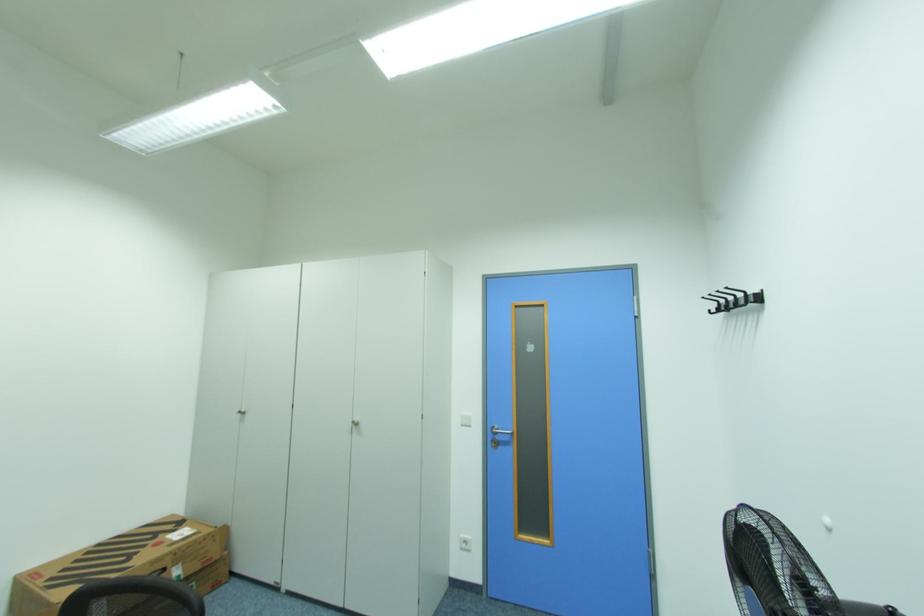
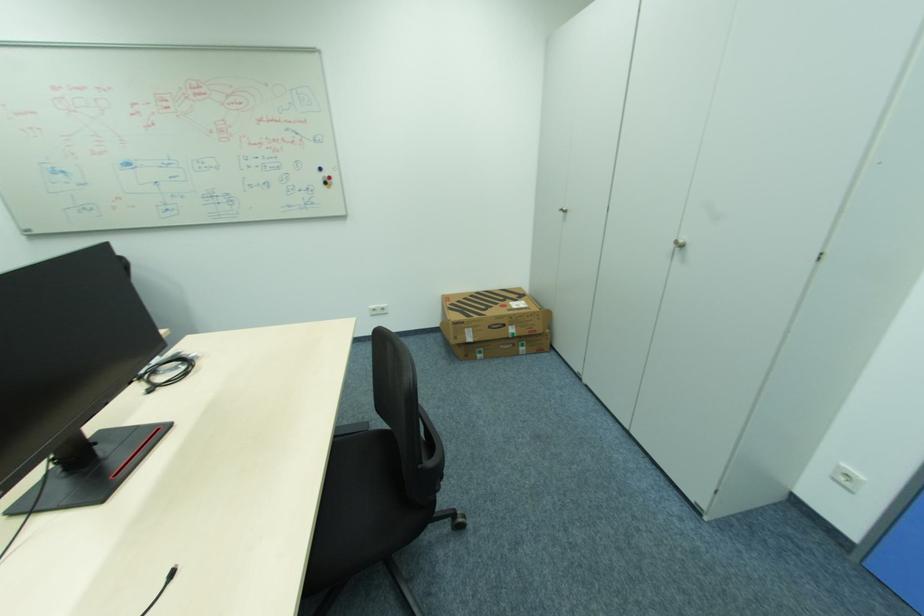
In the second image, find the point that corresponds to (244,411) in the first image.

(565, 209)